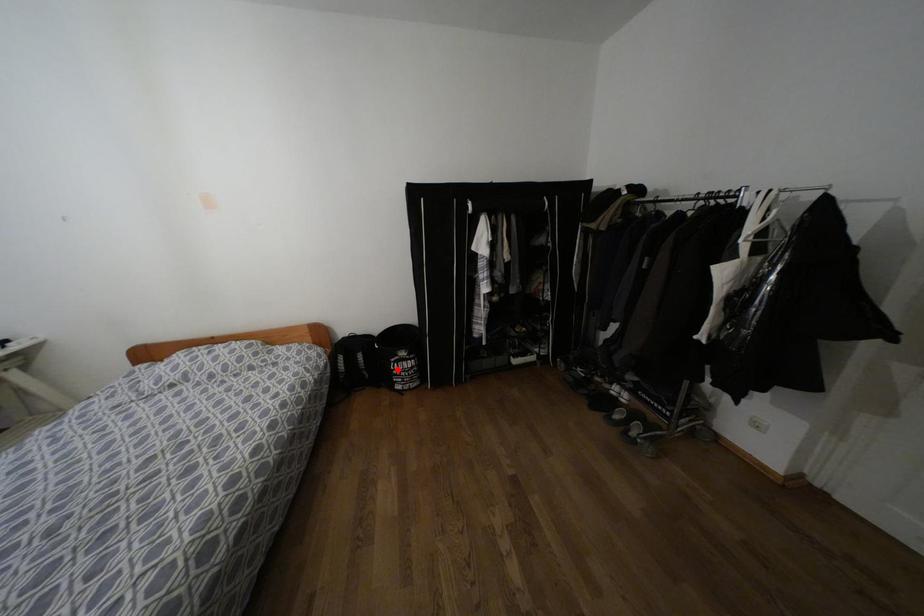
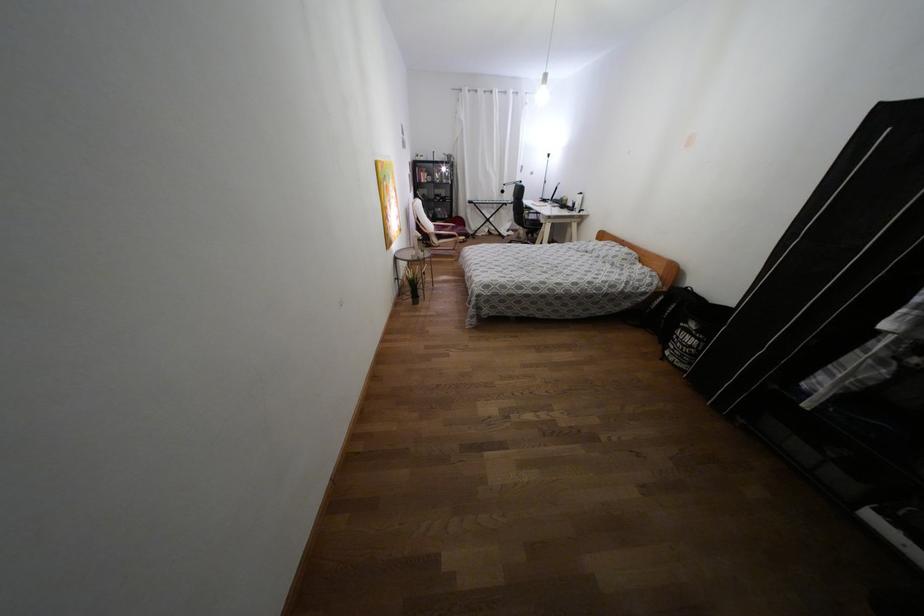
Find the pixel in the second image that matches the highlighted location in the first image.

(676, 337)